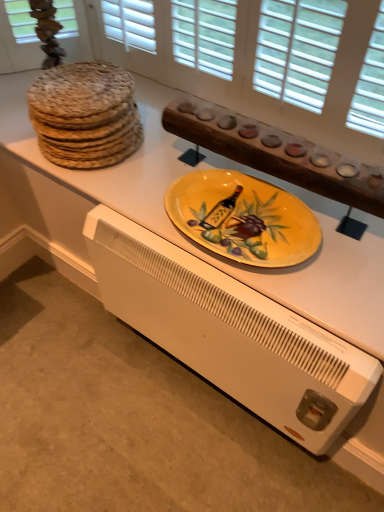
The image size is (384, 512). Find the location of `vacant space in yellow ceramic plate at center (from a real-world perspective)`. vacant space in yellow ceramic plate at center (from a real-world perspective) is located at coordinates (240, 229).